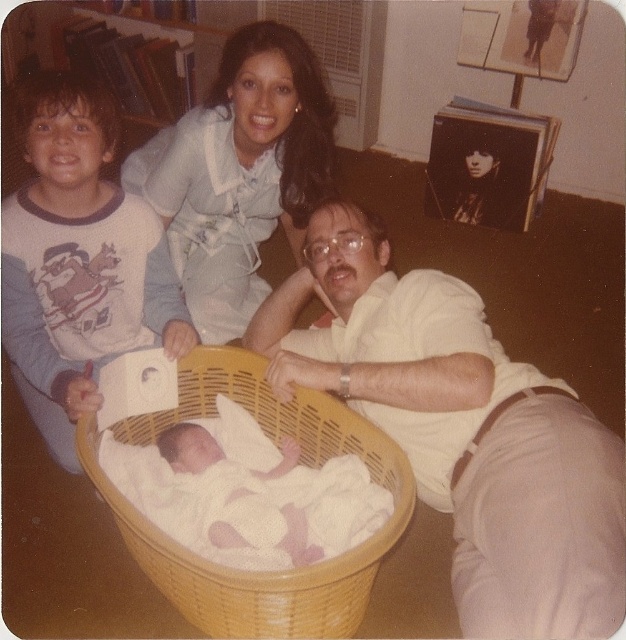
From the picture: Between light blue fabric dress at upper center and white soft cloth at center, which one is positioned lower?

white soft cloth at center is lower down.

Can you confirm if light blue fabric dress at upper center is positioned above white soft cloth at center?

Indeed, light blue fabric dress at upper center is positioned over white soft cloth at center.

Which is in front, point (155, 177) or point (285, 515)?

Point (285, 515) is in front.

Locate an element on the screen. Image resolution: width=626 pixels, height=640 pixels. light blue fabric dress at upper center is located at coordinates (239, 172).

How much distance is there between white matte shirt at center and white soft cloth at center?

The distance of white matte shirt at center from white soft cloth at center is 10.14 inches.

The width and height of the screenshot is (626, 640). What do you see at coordinates (461, 429) in the screenshot?
I see `white matte shirt at center` at bounding box center [461, 429].

The width and height of the screenshot is (626, 640). Find the location of `white matte shirt at center`. white matte shirt at center is located at coordinates (x=461, y=429).

Is white matte shirt at center below white soft fabric newborn at lower left?

Yes, white matte shirt at center is below white soft fabric newborn at lower left.

Which is below, white matte shirt at center or white soft fabric newborn at lower left?

Positioned lower is white matte shirt at center.

What are the coordinates of `white matte shirt at center` in the screenshot? It's located at (461, 429).

Locate an element on the screen. white matte shirt at center is located at coordinates (461, 429).